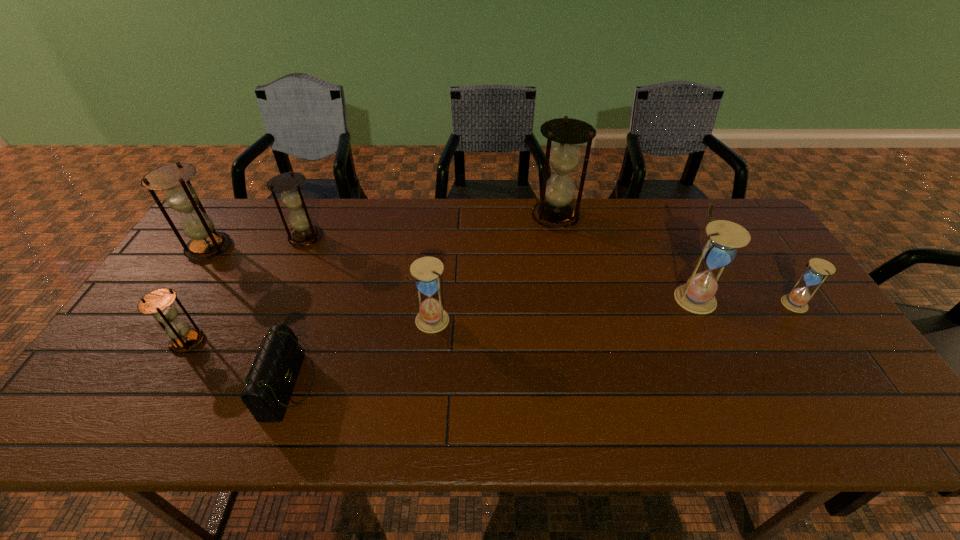
Where is `the tallest object`? the tallest object is located at coordinates (564, 156).

Where is `the rightmost brown hourglass`? The height and width of the screenshot is (540, 960). the rightmost brown hourglass is located at coordinates (564, 156).

Identify the location of the third smallest brown hourglass. (206, 242).

Locate an element on the screen. the second white hourglass from right to left is located at coordinates (698, 294).

Find the location of a particular element. the biggest white hourglass is located at coordinates (698, 294).

Locate an element on the screen. This screenshot has width=960, height=540. the third biggest brown hourglass is located at coordinates click(288, 184).

The height and width of the screenshot is (540, 960). Find the location of `the fifth hourglass from right to left`. the fifth hourglass from right to left is located at coordinates (288, 184).

At what (x,y) coordinates should I click in order to perform the action: click on the leftmost white hourglass. Please return your answer as a coordinate pair (x, y). Looking at the image, I should click on (432, 318).

Locate an element on the screen. The height and width of the screenshot is (540, 960). the fifth object from left to right is located at coordinates (432, 318).

Find the location of `the rightmost white hourglass`. the rightmost white hourglass is located at coordinates (818, 269).